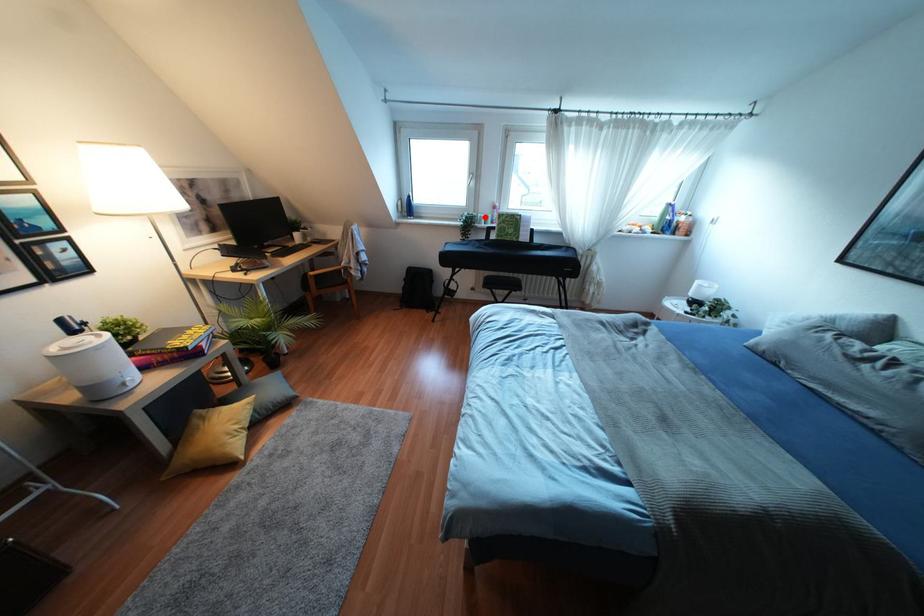
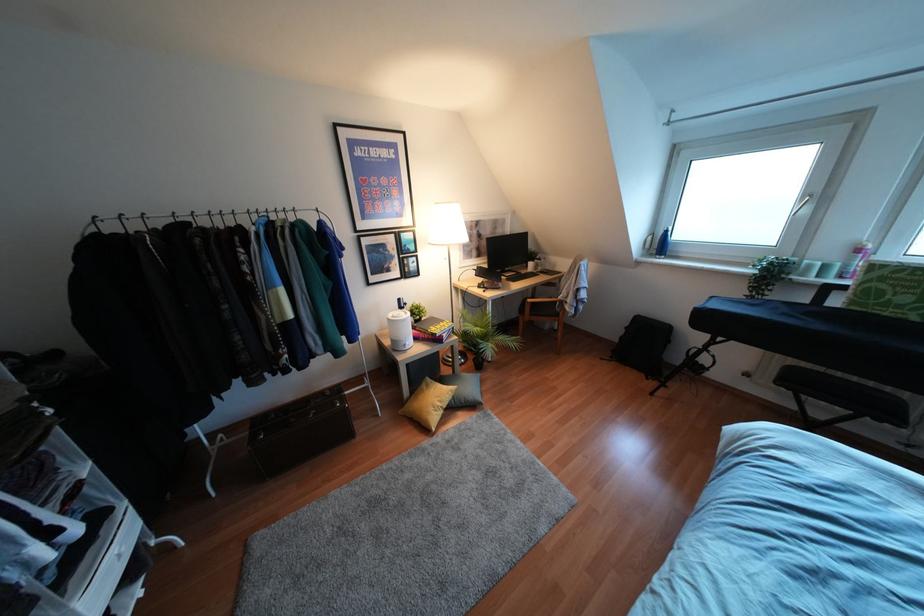
Question: I am providing you with two images of the same scene from different viewpoints. A red point is shown in image1. For the corresponding object point in image2, is it positioned nearer or farther from the camera?

Choices:
 (A) Nearer
 (B) Farther

Answer: (B)